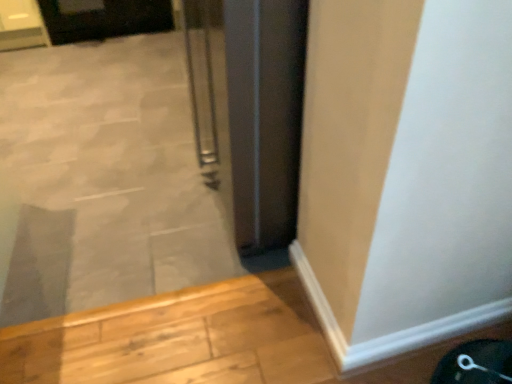
Consider the image. What is the approximate width of black glossy door at upper left?

black glossy door at upper left is 25.83 inches wide.

At what (x,y) coordinates should I click in order to perform the action: click on black glossy door at upper left. Please return your answer as a coordinate pair (x, y). The width and height of the screenshot is (512, 384). Looking at the image, I should click on (103, 18).

Describe the element at coordinates (103, 18) in the screenshot. I see `black glossy door at upper left` at that location.

In order to face black glossy door at upper left, should I rotate leftwards or rightwards?

To face it directly, rotate left by 18.830 degrees.

This screenshot has height=384, width=512. In order to click on black glossy door at upper left in this screenshot , I will do `click(103, 18)`.